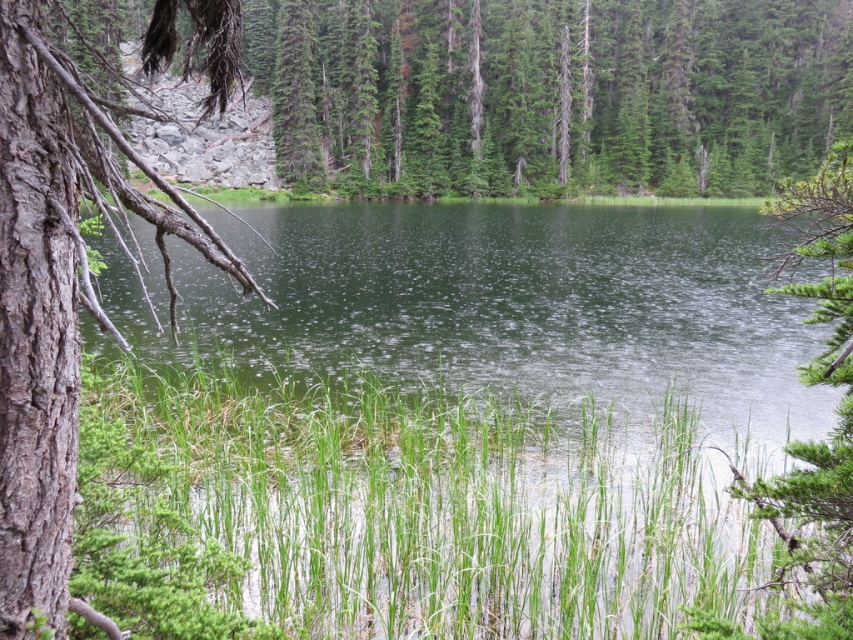
You are an environmental scientist analyzing the biodiversity of this area. You need to compare the widths of the green textured tree at upper center and the smooth bark tree at left. Which tree has a greater width?

The green textured tree at upper center has a greater width than the smooth bark tree at left according to the description.

You are an environmental scientist assessing the biodiversity of this area. You observe the green textured tree at upper center and the smooth bark tree at left. Which tree would you expect to provide more nesting opportunities for birds based on their physical characteristics?

The green textured tree at upper center is much taller than the smooth bark tree at left, so it would provide more nesting opportunities for birds due to its greater height offering better visibility and protection.